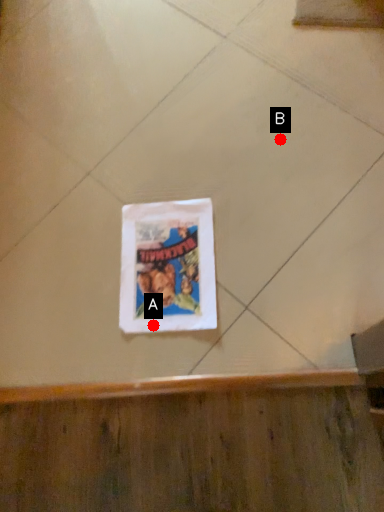
Question: Two points are circled on the image, labeled by A and B beside each circle. Among these points, which one is farthest from the camera?

Choices:
 (A) A is further
 (B) B is further

Answer: (B)